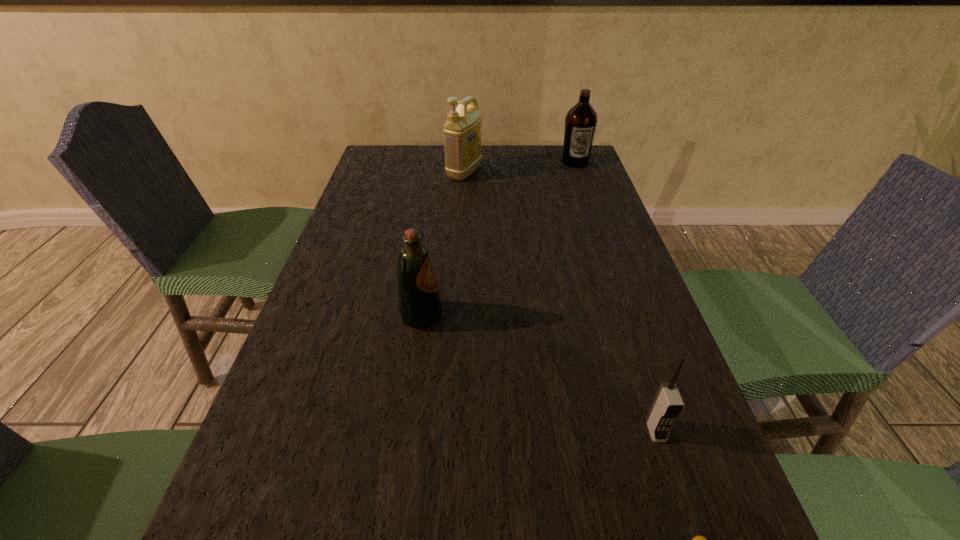
At what (x,y) coordinates should I click in order to perform the action: click on detergent. Please return your answer as a coordinate pair (x, y). The width and height of the screenshot is (960, 540). Looking at the image, I should click on (x=462, y=132).

Locate an element on the screen. The width and height of the screenshot is (960, 540). the farther olive oil is located at coordinates (581, 120).

The height and width of the screenshot is (540, 960). In order to click on the left olive oil in this screenshot , I will do (x=419, y=303).

Find the location of a particular element. This screenshot has height=540, width=960. the third farthest object is located at coordinates (419, 303).

In order to click on the fourth tallest object in this screenshot , I will do `click(668, 404)`.

This screenshot has width=960, height=540. Find the location of `cellular telephone`. cellular telephone is located at coordinates (668, 404).

This screenshot has height=540, width=960. Identify the location of vacant space located on the left of the detergent. (431, 173).

I want to click on vacant space located 0.400m on the label of the right olive oil, so click(x=602, y=240).

What are the coordinates of `vacant space located on the front-facing side of the third farthest object` in the screenshot? It's located at (483, 315).

Image resolution: width=960 pixels, height=540 pixels. In order to click on detergent that is at the far edge in this screenshot , I will do `click(462, 132)`.